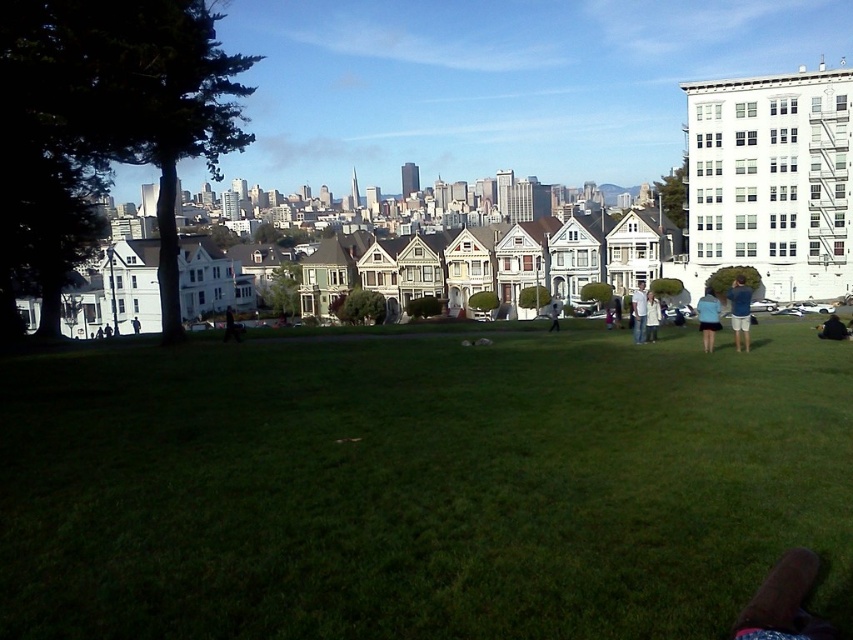
Can you confirm if light blue shirt at center is positioned above white matte jacket at center?

No, light blue shirt at center is not above white matte jacket at center.

Does light blue shirt at center have a lesser height compared to white matte jacket at center?

No.

This screenshot has width=853, height=640. Find the location of `light blue shirt at center`. light blue shirt at center is located at coordinates (637, 310).

The image size is (853, 640). I want to click on light blue shirt at center, so (x=637, y=310).

Describe the element at coordinates (708, 317) in the screenshot. Image resolution: width=853 pixels, height=640 pixels. I see `blue fabric shorts at lower right` at that location.

I want to click on blue fabric shorts at lower right, so click(x=708, y=317).

Who is positioned more to the right, green grass at center or light blue shirt at center?

From the viewer's perspective, light blue shirt at center appears more on the right side.

Where is `green grass at center`? green grass at center is located at coordinates (419, 486).

Identify the location of green grass at center. Image resolution: width=853 pixels, height=640 pixels. (419, 486).